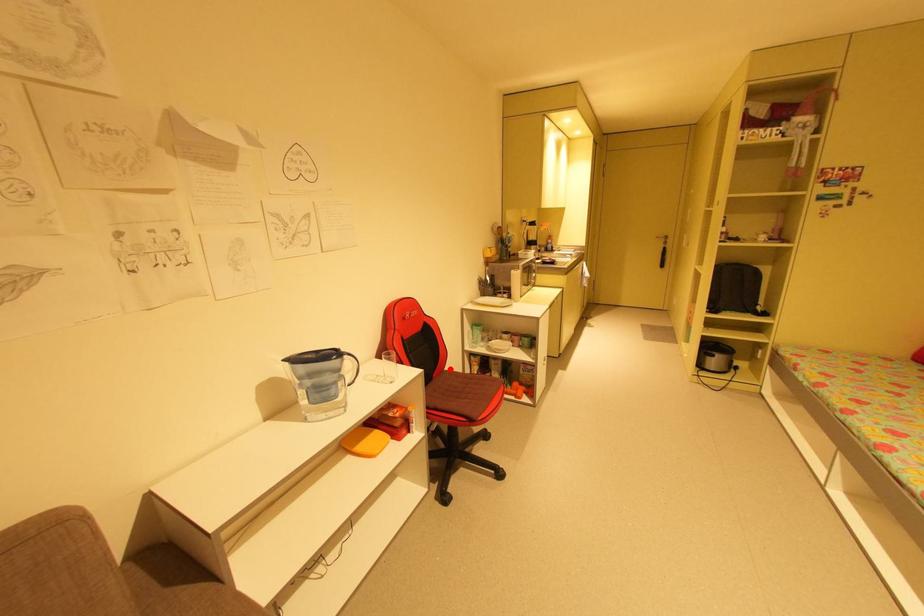
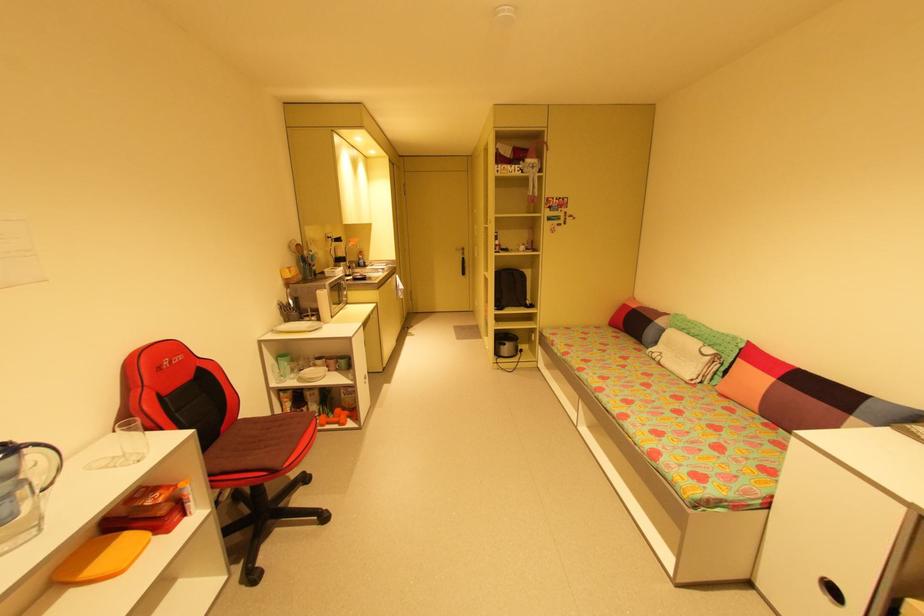
Question: I am providing you with two images of the same scene from different viewpoints. Given a red point in image1, look at the same physical point in image2. Is it:

Choices:
 (A) Closer to the viewpoint
 (B) Farther from the viewpoint

Answer: (A)